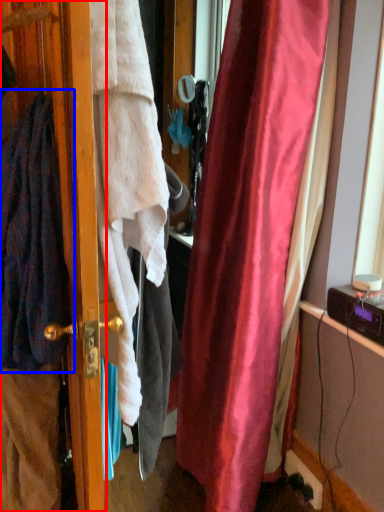
Question: Which object appears closest to the camera in this image, screen door (highlighted by a red box) or cardigan (highlighted by a blue box)?

Choices:
 (A) screen door
 (B) cardigan

Answer: (A)